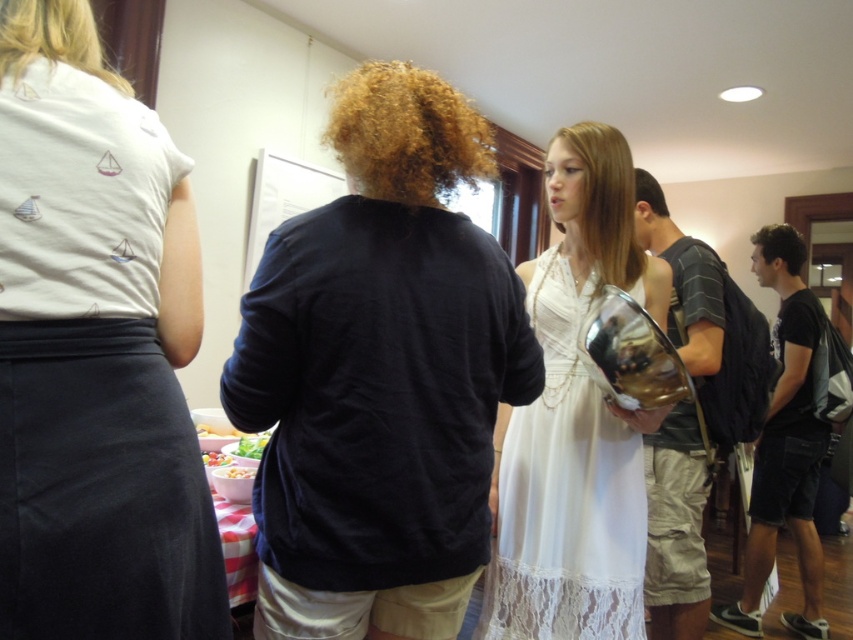
You are at a party and want to introduce yourself to the person with curly blonde hair at center. To do so, you should approach from the left side of the white lace dress at center. Is this the correct direction?

Yes, because the white lace dress at center is to the right of curly blonde hair at center, so approaching from the left side of the white lace dress at center would place you near the curly blonde hair at center.

You are a photographer at the event and want to capture a photo of both the white lace dress at center and the curly blonde hair at center. Since the camera has a limited focus range, which object should you prioritize to ensure it is in focus first?

The white lace dress at center is bigger than the curly blonde hair at center, so you should prioritize focusing on the white lace dress at center first to ensure it is in focus.